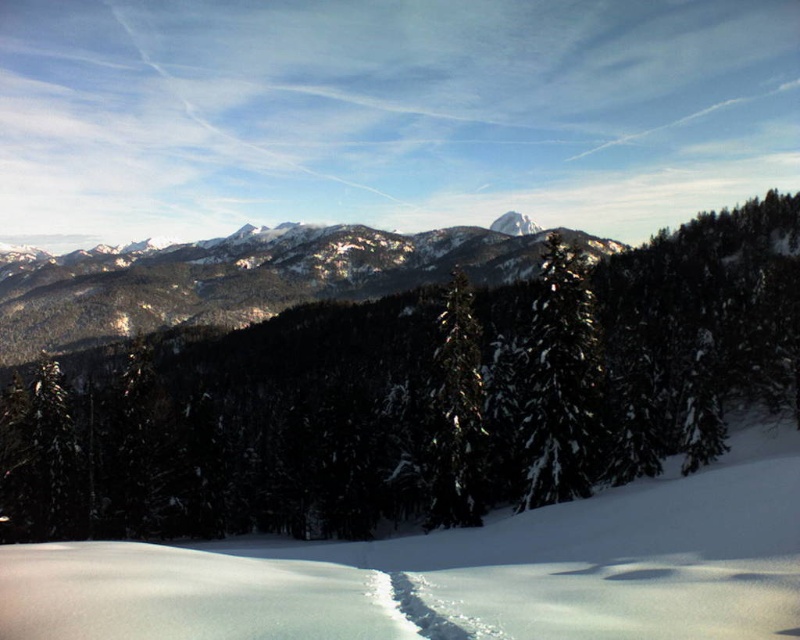
Question: Is the position of green textured pine tree at center more distant than that of white snow at center?

Choices:
 (A) yes
 (B) no

Answer: (A)

Question: Is white snow at center further to the viewer compared to snowy rocky mountain at center?

Choices:
 (A) no
 (B) yes

Answer: (A)

Question: Which is nearer to the white snow at center?

Choices:
 (A) green glossy tree at center
 (B) green textured pine tree at center
 (C) snow-covered evergreen at center

Answer: (C)

Question: Which object is positioned farthest from the snowy rocky mountain at center?

Choices:
 (A) green glossy tree at center
 (B) white snow at center
 (C) snow-covered evergreen at center

Answer: (C)

Question: Does green textured pine tree at center have a greater width compared to snow-covered evergreen at center?

Choices:
 (A) no
 (B) yes

Answer: (B)

Question: Which object appears farthest from the camera in this image?

Choices:
 (A) green glossy tree at center
 (B) snow-covered evergreen at center
 (C) snowy rocky mountain at center
 (D) white snow at center

Answer: (C)